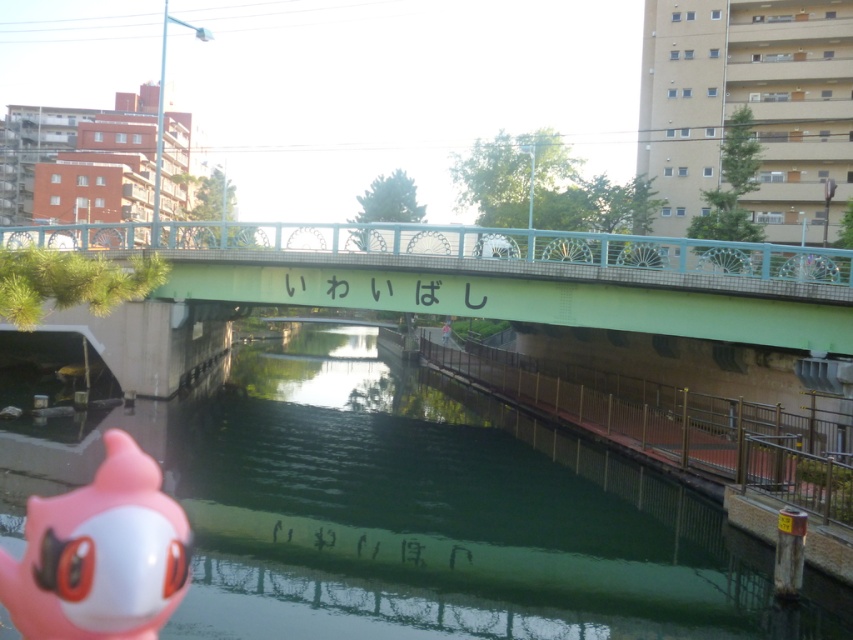
Does green smooth water at center appear over green concrete bridge at center?

Actually, green smooth water at center is below green concrete bridge at center.

Who is shorter, green smooth water at center or green concrete bridge at center?

green smooth water at center is shorter.

Between point (225, 397) and point (782, 314), which one is positioned in front?

Point (782, 314)

The width and height of the screenshot is (853, 640). Identify the location of green smooth water at center. (408, 509).

Is green smooth water at center wider than pink rubber toy at lower left?

Yes.

Find the location of `green smooth water at center`. green smooth water at center is located at coordinates (408, 509).

This screenshot has width=853, height=640. What do you see at coordinates (408, 509) in the screenshot? I see `green smooth water at center` at bounding box center [408, 509].

This screenshot has width=853, height=640. I want to click on green smooth water at center, so [x=408, y=509].

Which is behind, point (67, 525) or point (599, 426)?

Positioned behind is point (599, 426).

Looking at this image, who is more forward, (9, 602) or (833, 493)?

Positioned in front is point (9, 602).

Does point (80, 560) lie in front of point (724, 449)?

Yes.

In order to click on pink rubber toy at lower left in this screenshot , I will do `click(100, 554)`.